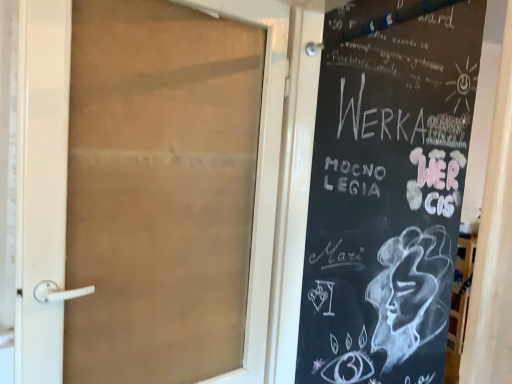
Describe the element at coordinates (387, 190) in the screenshot. I see `black chalkboard at right` at that location.

I want to click on black chalkboard at right, so click(387, 190).

Identify the location of translucent glass door at center. This screenshot has height=384, width=512. (42, 179).

Image resolution: width=512 pixels, height=384 pixels. Describe the element at coordinates (42, 179) in the screenshot. I see `translucent glass door at center` at that location.

Image resolution: width=512 pixels, height=384 pixels. I want to click on black chalkboard at right, so click(x=387, y=190).

Between black chalkboard at right and translucent glass door at center, which one appears on the left side from the viewer's perspective?

translucent glass door at center.

From the picture: Which object is further away from the camera taking this photo, black chalkboard at right or translucent glass door at center?

translucent glass door at center is behind.

Does point (320, 213) lie behind point (261, 279)?

Yes, point (320, 213) is farther from viewer.

From the image's perspective, relative to translucent glass door at center, is black chalkboard at right above or below?

From the image's perspective, black chalkboard at right appears below translucent glass door at center.

From a real-world perspective, which is physically below, black chalkboard at right or translucent glass door at center?

translucent glass door at center is physically lower.

Does black chalkboard at right have a greater width compared to translucent glass door at center?

Indeed, black chalkboard at right has a greater width compared to translucent glass door at center.

Between black chalkboard at right and translucent glass door at center, which one has less height?

translucent glass door at center.

Between black chalkboard at right and translucent glass door at center, which one has larger size?

With larger size is black chalkboard at right.

Which is correct: black chalkboard at right is inside translucent glass door at center, or outside of it?

black chalkboard at right cannot be found inside translucent glass door at center.

Is black chalkboard at right far away from translucent glass door at center?

No, black chalkboard at right is in close proximity to translucent glass door at center.

Is black chalkboard at right aimed at translucent glass door at center?

Yes, black chalkboard at right faces towards translucent glass door at center.

Identify the location of door located underneath the black chalkboard at right (from a real-world perspective). The width and height of the screenshot is (512, 384). (42, 179).

Is translucent glass door at center to the right of black chalkboard at right from the viewer's perspective?

No.

Is translucent glass door at center closer to the viewer compared to black chalkboard at right?

No, it is not.

Is point (281, 98) closer or farther from the camera than point (332, 280)?

Clearly, point (281, 98) is closer to the camera than point (332, 280).

From the image's perspective, which one is positioned higher, translucent glass door at center or black chalkboard at right?

From the image's view, translucent glass door at center is above.

From a real-world perspective, is translucent glass door at center above or below black chalkboard at right?

translucent glass door at center is situated lower than black chalkboard at right in the real world.

In terms of width, does translucent glass door at center look wider or thinner when compared to black chalkboard at right?

Considering their sizes, translucent glass door at center looks slimmer than black chalkboard at right.

Does translucent glass door at center have a greater height compared to black chalkboard at right?

In fact, translucent glass door at center may be shorter than black chalkboard at right.

Considering the relative sizes of translucent glass door at center and black chalkboard at right in the image provided, is translucent glass door at center bigger than black chalkboard at right?

No, translucent glass door at center is not bigger than black chalkboard at right.

Consider the image. Would you say translucent glass door at center is outside black chalkboard at right?

translucent glass door at center is positioned outside black chalkboard at right.

Are translucent glass door at center and black chalkboard at right making contact?

translucent glass door at center and black chalkboard at right are clearly separated.

Is translucent glass door at center looking in the opposite direction of black chalkboard at right?

No, black chalkboard at right is not at the back of translucent glass door at center.

In the image, there is a black chalkboard at right. Where is `door above it (from the image's perspective)`? door above it (from the image's perspective) is located at coordinates (42, 179).

I want to click on door on the left of black chalkboard at right, so click(x=42, y=179).

The image size is (512, 384). In the image, there is a black chalkboard at right. Identify the location of door below it (from a real-world perspective). (42, 179).